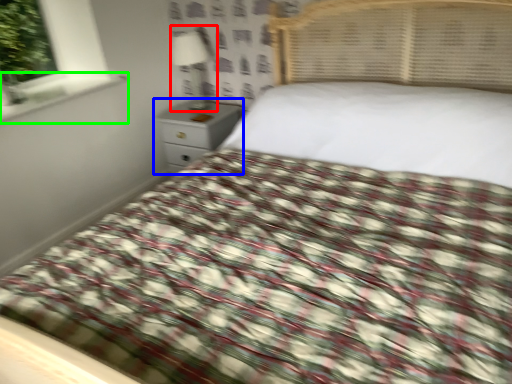
Question: Estimate the real-world distances between objects in this image. Which object is farther from lamp (highlighted by a red box), nightstand (highlighted by a blue box) or window sill (highlighted by a green box)?

Choices:
 (A) nightstand
 (B) window sill

Answer: (B)